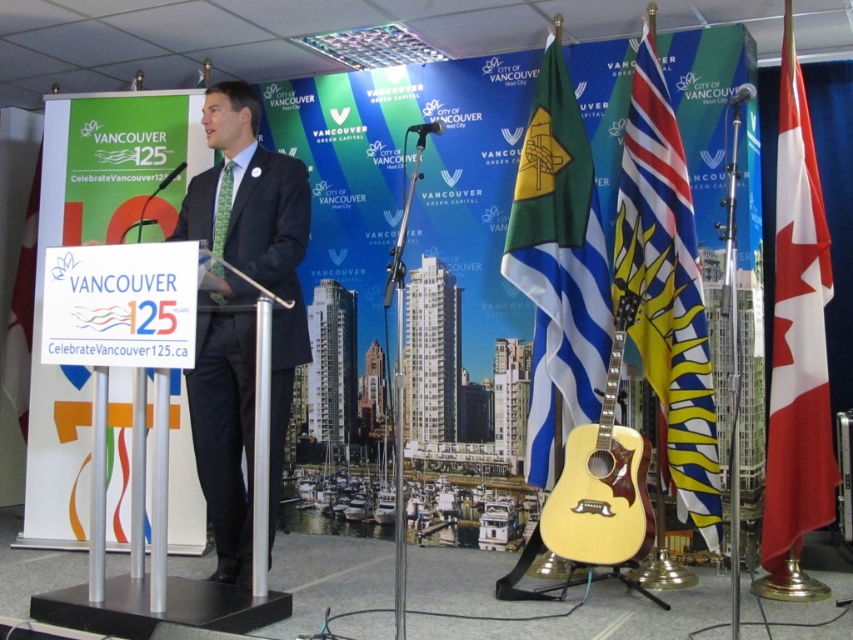
Question: Which of the following is the closest to the observer?

Choices:
 (A) red/white fabric flag at right
 (B) black matte suit at center

Answer: (B)

Question: Can you confirm if black matte suit at center is wider than red/white fabric flag at right?

Choices:
 (A) yes
 (B) no

Answer: (A)

Question: Can you confirm if yellow and black striped flag at center is wider than white paper at left?

Choices:
 (A) no
 (B) yes

Answer: (B)

Question: Which point is closer to the camera?

Choices:
 (A) natural wood acoustic guitar at center
 (B) green fabric flag at center
 (C) white paper at left
 (D) red/white fabric flag at right

Answer: (A)

Question: Does black matte suit at center appear over yellow and black striped flag at center?

Choices:
 (A) no
 (B) yes

Answer: (A)

Question: Which object appears farthest from the camera in this image?

Choices:
 (A) red/white fabric flag at right
 (B) natural wood acoustic guitar at center
 (C) yellow and black striped flag at center

Answer: (C)